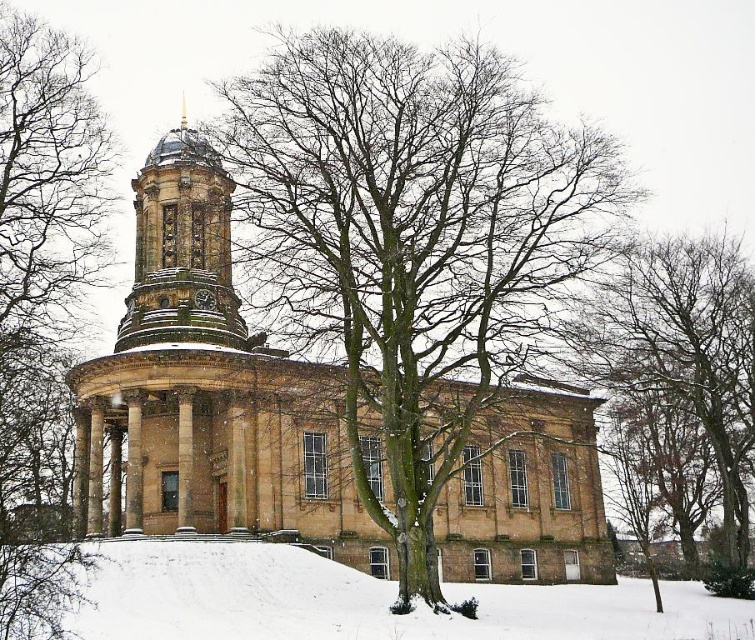
You are standing in the snowy landscape and want to walk from the bare branches at right to the golden stone clock tower at center. Which direction should you move to get closer to the tower?

You should move away from the bare branches at right because they are closer to you than the golden stone clock tower at center, so moving away from them would bring you closer to the tower.